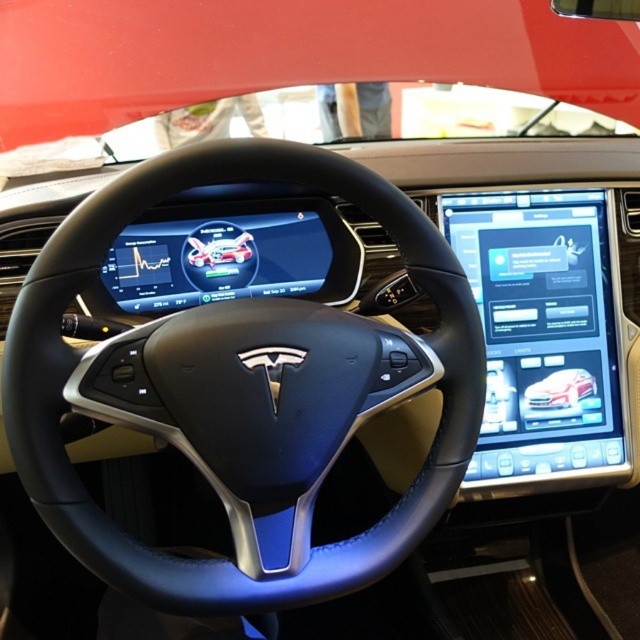
Question: Does black leather steering wheel at center appear under white glossy car at center?

Choices:
 (A) no
 (B) yes

Answer: (A)

Question: Among these points, which one is nearest to the camera?

Choices:
 (A) (554, 372)
 (B) (164, 577)

Answer: (B)

Question: Can you confirm if black leather steering wheel at center is positioned to the left of white glossy car at center?

Choices:
 (A) no
 (B) yes

Answer: (B)

Question: Which object appears farthest from the camera in this image?

Choices:
 (A) white glossy car at center
 (B) black leather steering wheel at center

Answer: (A)

Question: Which of the following is the closest to the observer?

Choices:
 (A) (189, 164)
 (B) (579, 381)

Answer: (A)

Question: Considering the relative positions of black leather steering wheel at center and white glossy car at center in the image provided, where is black leather steering wheel at center located with respect to white glossy car at center?

Choices:
 (A) right
 (B) left

Answer: (B)